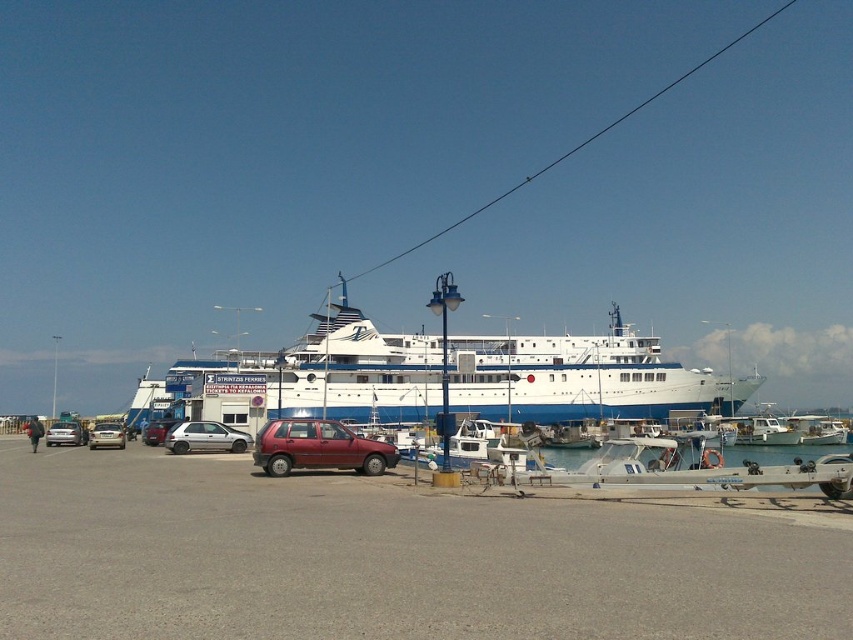
You are a parking attendant trying to locate two vehicles in the marina parking lot. You have a request to move the matte red car at center to make space for a wider vehicle. Which direction should you instruct the driver to move the car to avoid the maroon matte hatchback at center?

The maroon matte hatchback at center is positioned on the right side of the matte red car at center. To avoid it, the driver should move the matte red car at center to the left.

You are standing at the edge of the gray asphalt parking lot at center and want to take a photo of the marina boats behind it. Since the parking lot is between you and the boats, will you need to move closer or farther away from the parking lot to ensure the boats are in focus?

The gray asphalt parking lot at center is 8.43 meters away from camera. To focus on the boats beyond the parking lot, you would need to move closer to the parking lot so that both the parking lot and the boats are within the camera focus range.

You are a delivery person who needs to park your van in the marina parking area. The van requires a parking space that is at least 20 feet long. Based on the scene, can you determine if the distance between the gray asphalt parking lot at center and the silver metallic hatchback at center is sufficient for your van?

The distance between the gray asphalt parking lot at center and the silver metallic hatchback at center is 66.35 feet, which is more than enough to accommodate the van requiring 20 feet of space.